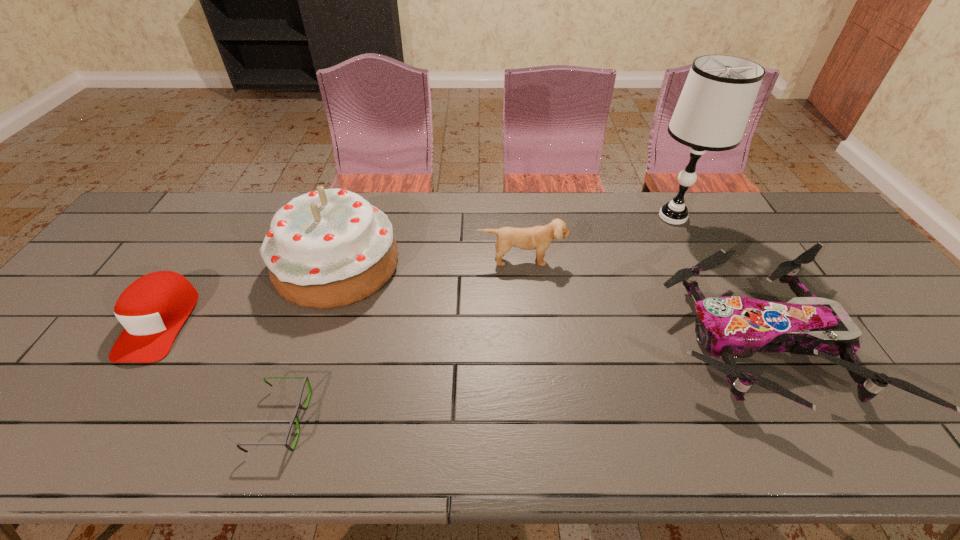
Find the location of a particular element. The height and width of the screenshot is (540, 960). free space at the near edge of the desktop is located at coordinates (292, 454).

In the image, there is a desktop. Where is `vacant space at the left edge`? This screenshot has height=540, width=960. vacant space at the left edge is located at coordinates (107, 268).

The height and width of the screenshot is (540, 960). Identify the location of vacant space at the right edge of the desktop. (819, 239).

In the image, there is a desktop. Identify the location of vacant space at the far left corner. Image resolution: width=960 pixels, height=540 pixels. (150, 218).

Locate an element on the screen. unoccupied area between the drone and the tallest object is located at coordinates (715, 279).

You are a GUI agent. You are given a task and a screenshot of the screen. Output one action in this format:
    pyautogui.click(x=<x>, y=<y>)
    Task: Click on the free space that is in between the baseball cap and the cake
    This screenshot has width=960, height=540.
    Given the screenshot: What is the action you would take?
    pyautogui.click(x=249, y=294)

You are a GUI agent. You are given a task and a screenshot of the screen. Output one action in this format:
    pyautogui.click(x=<x>, y=<y>)
    Task: Click on the vacant area that lies between the third tallest object and the shortest object
    This screenshot has width=960, height=540.
    Given the screenshot: What is the action you would take?
    pyautogui.click(x=401, y=340)

Where is `free space between the drone and the table lamp`? The width and height of the screenshot is (960, 540). free space between the drone and the table lamp is located at coordinates (715, 279).

Where is `empty space that is in between the drone and the leftmost object`? Image resolution: width=960 pixels, height=540 pixels. empty space that is in between the drone and the leftmost object is located at coordinates (459, 332).

Image resolution: width=960 pixels, height=540 pixels. I want to click on vacant region between the second tallest object and the leftmost object, so click(249, 294).